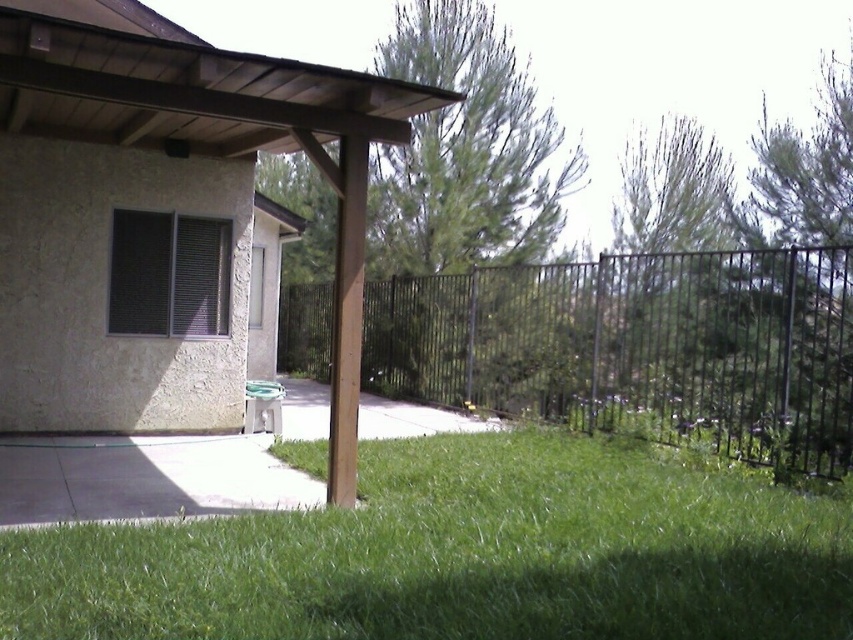
Can you confirm if green grass at lower center is shorter than black metal fence at center?

Indeed, green grass at lower center has a lesser height compared to black metal fence at center.

Is point (421, 554) behind point (492, 272)?

No, it is not.

Is point (166, 554) less distant than point (561, 380)?

Yes, it is.

Locate an element on the screen. green grass at lower center is located at coordinates (462, 556).

What do you see at coordinates (161, 216) in the screenshot?
I see `brown wood pergola at center` at bounding box center [161, 216].

Who is positioned more to the right, brown wood pergola at center or black metal fence at center?

black metal fence at center is more to the right.

Which is in front, point (91, 241) or point (695, 332)?

Point (91, 241)

Find the location of a particular element. The width and height of the screenshot is (853, 640). brown wood pergola at center is located at coordinates (161, 216).

Between point (608, 632) and point (149, 51), which one is positioned behind?

Positioned behind is point (149, 51).

In the scene shown: Who is positioned more to the left, green grass at lower center or brown wood pergola at center?

Positioned to the left is brown wood pergola at center.

Is point (740, 604) positioned behind point (160, 35)?

No.

Where is `green grass at lower center`? green grass at lower center is located at coordinates (462, 556).